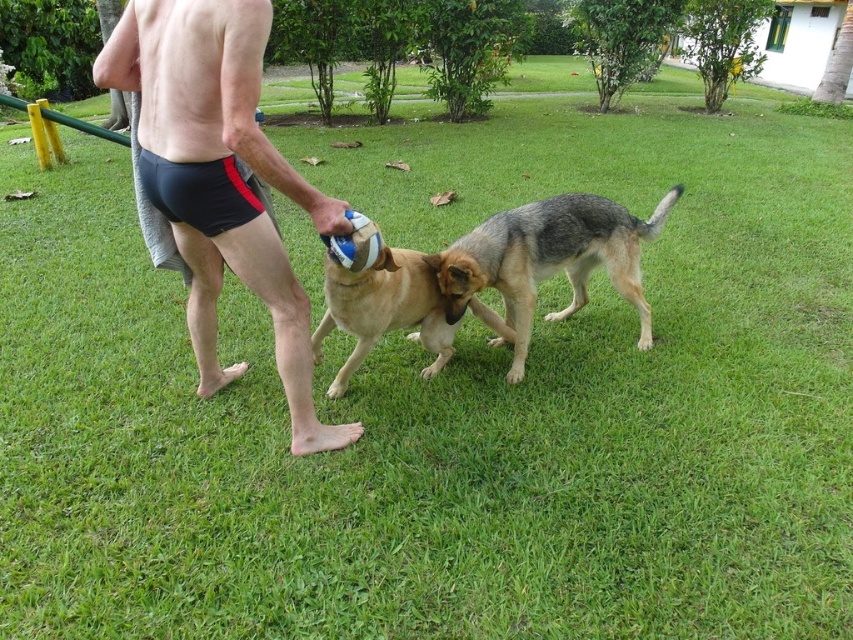
Does black matte shorts at center lie behind gray-furred dog at center?

No, black matte shorts at center is in front of gray-furred dog at center.

Is point (248, 248) more distant than point (640, 304)?

That is False.

Image resolution: width=853 pixels, height=640 pixels. Find the location of `black matte shorts at center`. black matte shorts at center is located at coordinates (222, 179).

Which is more to the left, gray-furred dog at center or golden fur dog at center?

golden fur dog at center is more to the left.

The image size is (853, 640). What do you see at coordinates (549, 259) in the screenshot? I see `gray-furred dog at center` at bounding box center [549, 259].

Find the location of a particular element. The width and height of the screenshot is (853, 640). gray-furred dog at center is located at coordinates (549, 259).

Is black matte shorts at center to the left of golden fur dog at center from the viewer's perspective?

Correct, you'll find black matte shorts at center to the left of golden fur dog at center.

Can you confirm if black matte shorts at center is positioned above golden fur dog at center?

Indeed, black matte shorts at center is positioned over golden fur dog at center.

Is point (120, 76) positioned in front of point (389, 316)?

Yes.

At what (x,y) coordinates should I click in order to perform the action: click on black matte shorts at center. Please return your answer as a coordinate pair (x, y). This screenshot has width=853, height=640. Looking at the image, I should click on (222, 179).